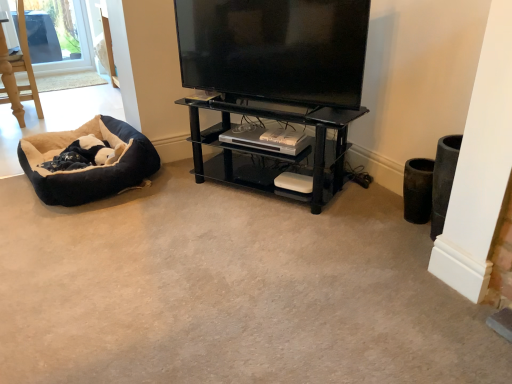
Question: From a real-world perspective, is soft plush dog bed at left physically below black glossy flat-screen tv at upper center?

Choices:
 (A) yes
 (B) no

Answer: (A)

Question: Is soft plush dog bed at left to the left of black glossy flat-screen tv at upper center from the viewer's perspective?

Choices:
 (A) no
 (B) yes

Answer: (B)

Question: Would you say soft plush dog bed at left contains black glossy flat-screen tv at upper center?

Choices:
 (A) no
 (B) yes

Answer: (A)

Question: Considering the relative sizes of soft plush dog bed at left and black glossy flat-screen tv at upper center in the image provided, is soft plush dog bed at left bigger than black glossy flat-screen tv at upper center?

Choices:
 (A) yes
 (B) no

Answer: (A)

Question: Is soft plush dog bed at left outside black glossy flat-screen tv at upper center?

Choices:
 (A) yes
 (B) no

Answer: (A)

Question: Considering the relative sizes of soft plush dog bed at left and black glossy flat-screen tv at upper center in the image provided, is soft plush dog bed at left shorter than black glossy flat-screen tv at upper center?

Choices:
 (A) no
 (B) yes

Answer: (B)

Question: Considering the relative sizes of black glass shelf at center and black glossy flat-screen tv at upper center in the image provided, is black glass shelf at center smaller than black glossy flat-screen tv at upper center?

Choices:
 (A) yes
 (B) no

Answer: (B)

Question: Can you confirm if black glass shelf at center is positioned to the left of black glossy flat-screen tv at upper center?

Choices:
 (A) yes
 (B) no

Answer: (B)

Question: From the image's perspective, is black glass shelf at center beneath black glossy flat-screen tv at upper center?

Choices:
 (A) yes
 (B) no

Answer: (A)

Question: Can you confirm if black glass shelf at center is shorter than black glossy flat-screen tv at upper center?

Choices:
 (A) no
 (B) yes

Answer: (A)

Question: From a real-world perspective, is black glass shelf at center located beneath black glossy flat-screen tv at upper center?

Choices:
 (A) no
 (B) yes

Answer: (B)

Question: Is black glass shelf at center bigger than black glossy flat-screen tv at upper center?

Choices:
 (A) no
 (B) yes

Answer: (B)

Question: Is black glass shelf at center next to black plush dog bed at lower left?

Choices:
 (A) no
 (B) yes

Answer: (A)